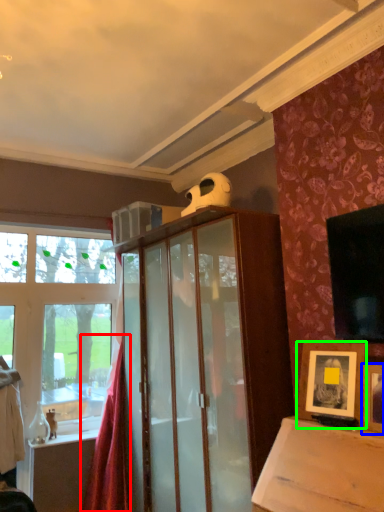
Question: Based on their relative distances, which object is nearer to curtain (highlighted by a red box)? Choose from picture frame (highlighted by a blue box) and picture frame (highlighted by a green box).

Choices:
 (A) picture frame
 (B) picture frame

Answer: (B)